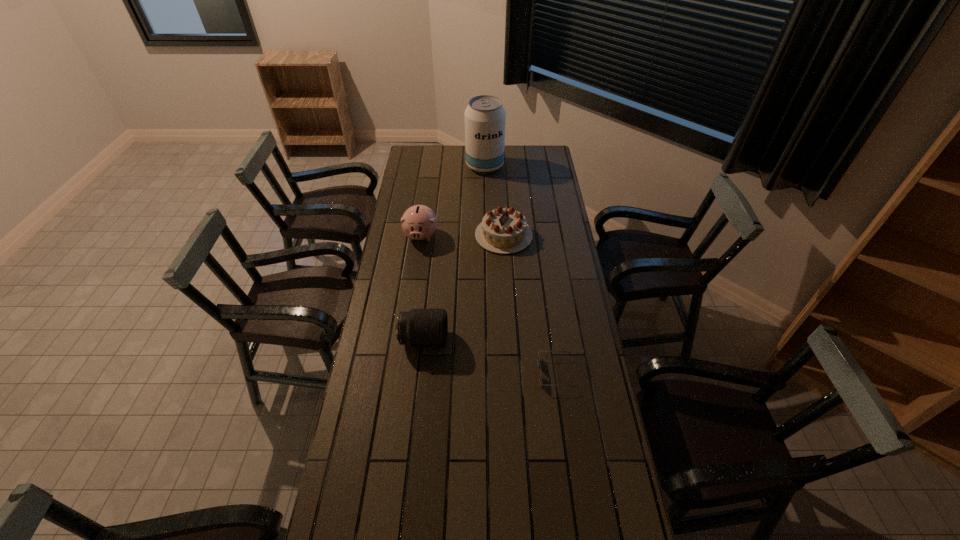
I want to click on alcohol, so click(485, 117).

At what (x,y) coordinates should I click in order to perform the action: click on the tallest object. Please return your answer as a coordinate pair (x, y). Image resolution: width=960 pixels, height=540 pixels. Looking at the image, I should click on (485, 117).

Identify the location of piggy bank. Image resolution: width=960 pixels, height=540 pixels. (419, 222).

Locate an element on the screen. telephoto lens is located at coordinates (419, 327).

The image size is (960, 540). In order to click on birthday cake in this screenshot , I will do `click(502, 230)`.

Locate an element on the screen. The image size is (960, 540). the nearest object is located at coordinates (539, 365).

Image resolution: width=960 pixels, height=540 pixels. Find the location of `the shortest object`. the shortest object is located at coordinates (539, 365).

The height and width of the screenshot is (540, 960). I want to click on free space located 0.230m on the right of the alcohol, so click(x=545, y=166).

The image size is (960, 540). I want to click on vacant space located 0.190m on the back of the piggy bank, so click(426, 198).

The image size is (960, 540). I want to click on vacant area situated on the surface of the fourth farthest object, so click(x=483, y=340).